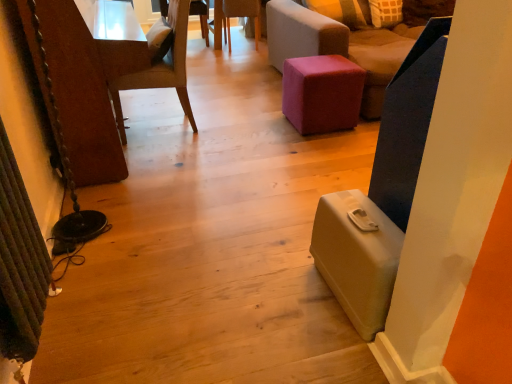
Question: Is wooden chair at center, acting as the third chair starting from the left, further to camera compared to velvet pink ottoman at center?

Choices:
 (A) yes
 (B) no

Answer: (A)

Question: Does wooden chair at center, acting as the third chair starting from the left, have a lesser height compared to velvet pink ottoman at center?

Choices:
 (A) no
 (B) yes

Answer: (A)

Question: Does wooden chair at center, arranged as the second chair when viewed from the right, have a larger size compared to velvet pink ottoman at center?

Choices:
 (A) yes
 (B) no

Answer: (A)

Question: Does wooden chair at center, acting as the third chair starting from the left, have a lesser width compared to velvet pink ottoman at center?

Choices:
 (A) yes
 (B) no

Answer: (B)

Question: Is wooden chair at center, arranged as the second chair when viewed from the right, taller than velvet pink ottoman at center?

Choices:
 (A) yes
 (B) no

Answer: (A)

Question: Is wooden chair at center, arranged as the second chair when viewed from the right, closer to the viewer compared to velvet pink ottoman at center?

Choices:
 (A) no
 (B) yes

Answer: (A)

Question: Can you confirm if wooden chair at center, arranged as the second chair when viewed from the right, is thinner than wooden textured chair at upper center, which is the first chair from left to right?

Choices:
 (A) yes
 (B) no

Answer: (A)

Question: Can we say wooden chair at center, acting as the third chair starting from the left, lies outside wooden textured chair at upper center, which is the first chair from left to right?

Choices:
 (A) yes
 (B) no

Answer: (A)

Question: From the image's perspective, is wooden chair at center, arranged as the second chair when viewed from the right, on top of wooden textured chair at upper center, which is counted as the fourth chair, starting from the right?

Choices:
 (A) no
 (B) yes

Answer: (A)

Question: Is wooden chair at center, acting as the third chair starting from the left, facing away from wooden textured chair at upper center, which is counted as the fourth chair, starting from the right?

Choices:
 (A) no
 (B) yes

Answer: (A)

Question: Can you confirm if wooden chair at center, acting as the third chair starting from the left, is positioned to the left of wooden textured chair at upper center, which is counted as the fourth chair, starting from the right?

Choices:
 (A) yes
 (B) no

Answer: (B)

Question: Does wooden chair at center, arranged as the second chair when viewed from the right, have a smaller size compared to wooden textured chair at upper center, which is counted as the fourth chair, starting from the right?

Choices:
 (A) yes
 (B) no

Answer: (A)

Question: Is velvet pink ottoman at center positioned far away from purple fabric ottoman at center, the first chair when ordered from right to left?

Choices:
 (A) yes
 (B) no

Answer: (B)